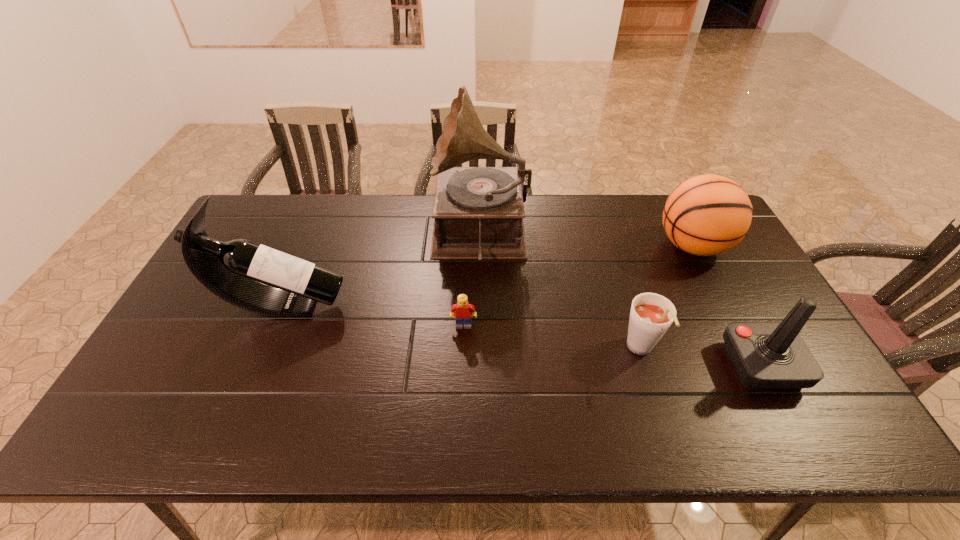
Where is `the tallest object`? the tallest object is located at coordinates (478, 212).

I want to click on the third farthest object, so click(234, 271).

Locate an element on the screen. The image size is (960, 540). the leftmost object is located at coordinates (234, 271).

Where is `basketball`? basketball is located at coordinates (705, 215).

The width and height of the screenshot is (960, 540). I want to click on joystick, so click(766, 355).

Locate an element on the screen. Image resolution: width=960 pixels, height=540 pixels. the fourth object from left to right is located at coordinates (651, 315).

I want to click on the fifth tallest object, so click(651, 315).

Locate an element on the screen. the shortest object is located at coordinates (463, 311).

Find the location of a particular element. Lego is located at coordinates (463, 311).

This screenshot has height=540, width=960. I want to click on free location located from the horn of the tallest object, so click(x=375, y=235).